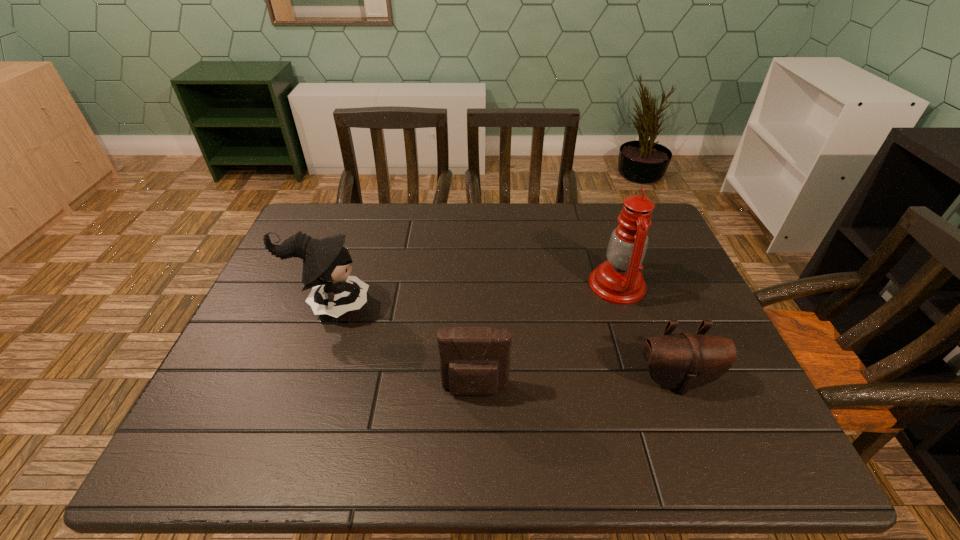
Locate an element on the screen. Image resolution: width=960 pixels, height=540 pixels. oil lamp located at the right edge is located at coordinates (619, 280).

Find the location of a particular element. pouch that is at the right edge is located at coordinates (683, 361).

In the image, there is a desktop. Identify the location of vacant area at the far edge. (471, 226).

This screenshot has height=540, width=960. Find the location of `free space at the near edge of the desktop`. free space at the near edge of the desktop is located at coordinates (325, 463).

In the image, there is a desktop. Find the location of `vacant space at the left edge`. vacant space at the left edge is located at coordinates (271, 379).

In the image, there is a desktop. Where is `vacant space at the right edge`? vacant space at the right edge is located at coordinates click(x=665, y=281).

Where is `free space at the far left corner of the desktop`? free space at the far left corner of the desktop is located at coordinates (346, 239).

Locate an element on the screen. vacant area at the far right corner of the desktop is located at coordinates (610, 224).

This screenshot has height=540, width=960. What are the coordinates of `vacant space that's between the third shortest object and the second object from left to right` in the screenshot? It's located at (402, 347).

Find the location of a particular element. free space that is in between the oil lamp and the left pouch is located at coordinates (546, 338).